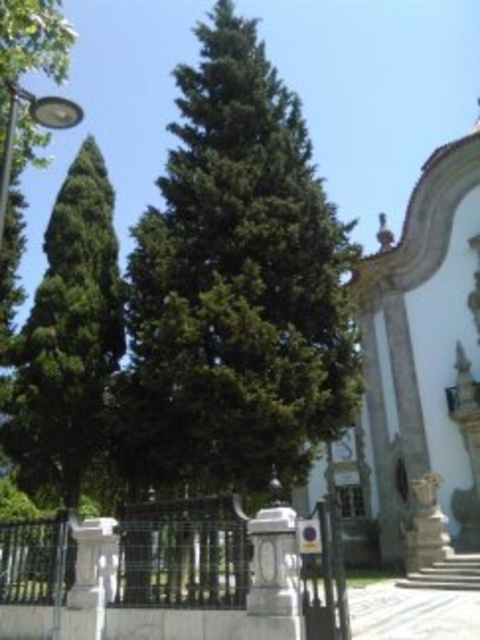
You are a landscape architect designing a pathway between the green leafy tree at center and the green leafy tree at left. Which tree has a wider trunk to consider for spacing?

The green leafy tree at center has a wider trunk than the green leafy tree at left, so you should consider spacing around it accordingly.

You are standing in front of the black metal gate and looking towards the green leafy tree at center and the green leafy tree at left. Which tree appears taller when viewed from this position?

The green leafy tree at center appears taller than the green leafy tree at left when viewed from this position because it is positioned above it in the scene.